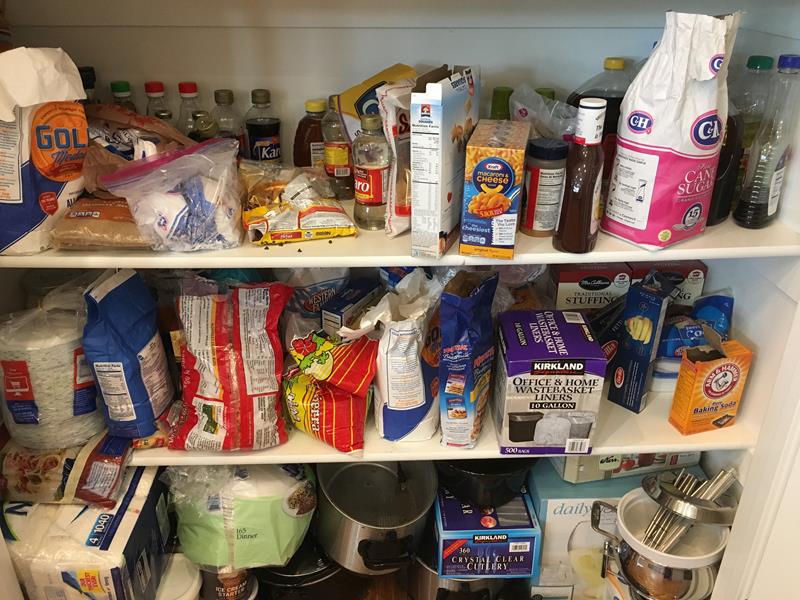
In order to click on disposable tableware in this screenshot , I will do `click(490, 543)`.